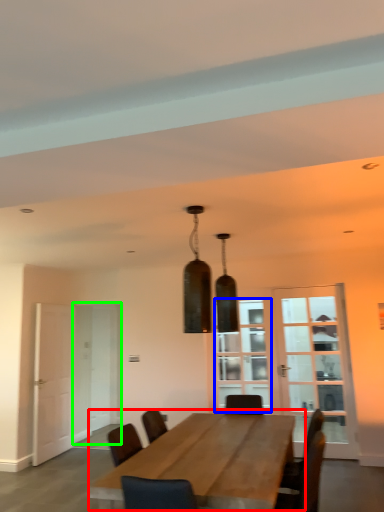
Question: Based on their relative distances, which object is nearer to table (highlighted by a red box)? Choose from window (highlighted by a blue box) and glass door (highlighted by a green box).

Choices:
 (A) window
 (B) glass door

Answer: (A)